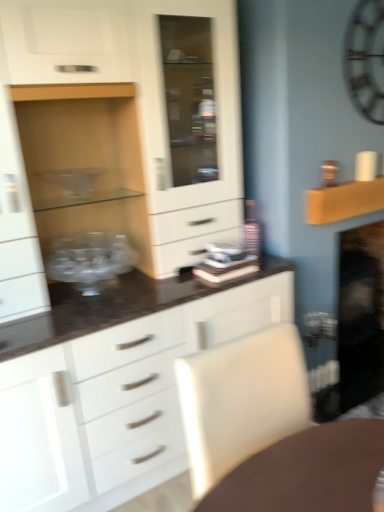
Describe the element at coordinates (137, 90) in the screenshot. I see `white matte cabinet at center` at that location.

This screenshot has height=512, width=384. What do you see at coordinates (241, 400) in the screenshot? I see `white leather swivel chair at lower right` at bounding box center [241, 400].

This screenshot has height=512, width=384. What are the coordinates of `wooden shelf at upper right` in the screenshot? It's located at (344, 201).

Image resolution: width=384 pixels, height=512 pixels. What do you see at coordinates (366, 59) in the screenshot?
I see `metallic silver clock at upper right` at bounding box center [366, 59].

Identify the location of white matte cabinet at center. The height and width of the screenshot is (512, 384). (137, 90).

In the scene shown: From a real-world perspective, is transparent glass bowl at left beneath white matte cabinet at center?

Correct, in the physical world, transparent glass bowl at left is lower than white matte cabinet at center.

Does transparent glass bowl at left lie behind white matte cabinet at center?

Yes, transparent glass bowl at left is further from the camera.

Are transparent glass bowl at left and white matte cabinet at center located far from each other?

They are positioned close to each other.

Is metallic silver clock at upper right to the left or to the right of wooden shelf at upper right in the image?

metallic silver clock at upper right is to the right of wooden shelf at upper right.

Is metallic silver clock at upper right thinner than wooden shelf at upper right?

Yes, metallic silver clock at upper right is thinner than wooden shelf at upper right.

From the image's perspective, which one is positioned higher, metallic silver clock at upper right or wooden shelf at upper right?

metallic silver clock at upper right.

Which is further, (345, 188) or (155, 67)?

The point (345, 188) is behind.

Find the location of `cabinetry located below the wooden shelf at upper right (from the image's perspective)`. cabinetry located below the wooden shelf at upper right (from the image's perspective) is located at coordinates (137, 90).

Is wooden shelf at upper right shorter than white matte cabinet at center?

Indeed, wooden shelf at upper right has a lesser height compared to white matte cabinet at center.

Would you say metallic silver clock at upper right is a long distance from transparent glass bowl at left?

Absolutely, metallic silver clock at upper right is distant from transparent glass bowl at left.

Is metallic silver clock at upper right wider or thinner than transparent glass bowl at left?

metallic silver clock at upper right is thinner than transparent glass bowl at left.

Is metallic silver clock at upper right aimed at transparent glass bowl at left?

No.

From a real-world perspective, is white matte cabinet at center above or below metallic silver clock at upper right?

white matte cabinet at center is situated lower than metallic silver clock at upper right in the real world.

From the image's perspective, is white matte cabinet at center above metallic silver clock at upper right?

No.

You are a GUI agent. You are given a task and a screenshot of the screen. Output one action in this format:
    pyautogui.click(x=<x>, y=<y>)
    Task: Click on the cabinetry to the left of metallic silver clock at upper right
    Image resolution: width=384 pixels, height=512 pixels.
    Given the screenshot: What is the action you would take?
    pyautogui.click(x=137, y=90)

Looking at this image, is white leather swivel chair at lower right shorter than transparent glass bowl at left?

In fact, white leather swivel chair at lower right may be taller than transparent glass bowl at left.

Is white leather swivel chair at lower right wider than transparent glass bowl at left?

Indeed, white leather swivel chair at lower right has a greater width compared to transparent glass bowl at left.

Can you tell me how much white leather swivel chair at lower right and transparent glass bowl at left differ in facing direction?

1.24 degrees.

From a real-world perspective, which object rests below the other?

In real-world perspective, white leather swivel chair at lower right is lower.

Are white leather swivel chair at lower right and wooden shelf at upper right making contact?

No, white leather swivel chair at lower right is not making contact with wooden shelf at upper right.

Looking at this image, from the image's perspective, relative to wooden shelf at upper right, is white leather swivel chair at lower right above or below?

Clearly, from the image's perspective, white leather swivel chair at lower right is below wooden shelf at upper right.

Considering the points (262, 388) and (334, 200), which point is in front, point (262, 388) or point (334, 200)?

The point (262, 388) is in front.

Where is `shelf positioned vertically above the white leather swivel chair at lower right (from a real-world perspective)`? This screenshot has width=384, height=512. shelf positioned vertically above the white leather swivel chair at lower right (from a real-world perspective) is located at coordinates (344, 201).

Locate an element on the screen. This screenshot has width=384, height=512. cabinetry that is above the transparent glass bowl at left (from a real-world perspective) is located at coordinates (137, 90).

Locate an element on the screen. The height and width of the screenshot is (512, 384). clock to the right of wooden shelf at upper right is located at coordinates (366, 59).

Which object lies nearer to the anchor point transparent glass bowl at left, wooden shelf at upper right or metallic silver clock at upper right?

Among the two, wooden shelf at upper right is located nearer to transparent glass bowl at left.

When comparing their distances from wooden shelf at upper right, does white matte cabinet at center or white leather swivel chair at lower right seem further?

white leather swivel chair at lower right.

Considering their positions, is metallic silver clock at upper right positioned further to wooden shelf at upper right than transparent glass bowl at left?

transparent glass bowl at left is further to wooden shelf at upper right.

Consider the image. When comparing their distances from metallic silver clock at upper right, does transparent glass bowl at left or white matte cabinet at center seem further?

Based on the image, transparent glass bowl at left appears to be further to metallic silver clock at upper right.

Looking at the image, which one is located closer to transparent glass bowl at left, white matte cabinet at center or metallic silver clock at upper right?

white matte cabinet at center.

Considering their positions, is white matte cabinet at center positioned further to white leather swivel chair at lower right than wooden shelf at upper right?

wooden shelf at upper right.

Based on their spatial positions, is metallic silver clock at upper right or transparent glass bowl at left closer to white matte cabinet at center?

Based on the image, transparent glass bowl at left appears to be nearer to white matte cabinet at center.

From the image, which object appears to be nearer to transparent glass bowl at left, white leather swivel chair at lower right or metallic silver clock at upper right?

white leather swivel chair at lower right is closer to transparent glass bowl at left.

The image size is (384, 512). In order to click on cabinetry between transparent glass bowl at left and wooden shelf at upper right in this screenshot , I will do `click(137, 90)`.

This screenshot has height=512, width=384. I want to click on cabinetry located between white leather swivel chair at lower right and wooden shelf at upper right in the depth direction, so click(x=137, y=90).

Find the location of a particular element. shelf between white matte cabinet at center and metallic silver clock at upper right from left to right is located at coordinates (344, 201).

You are a GUI agent. You are given a task and a screenshot of the screen. Output one action in this format:
    pyautogui.click(x=<x>, y=<y>)
    Task: Click on the shelf between transparent glass bowl at left and metallic silver clock at upper right from left to right
    The image size is (384, 512).
    Given the screenshot: What is the action you would take?
    pyautogui.click(x=344, y=201)